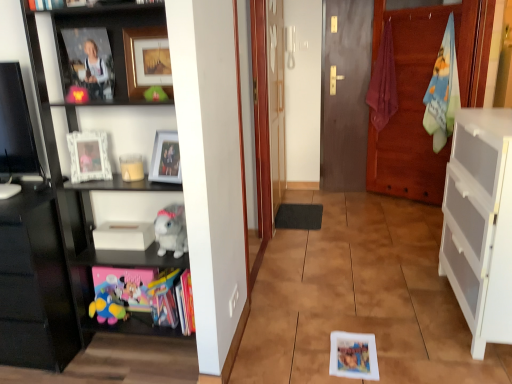
Where is `vacant area that is situated to the right of black glossy shelf at left`? Image resolution: width=512 pixels, height=384 pixels. vacant area that is situated to the right of black glossy shelf at left is located at coordinates (257, 339).